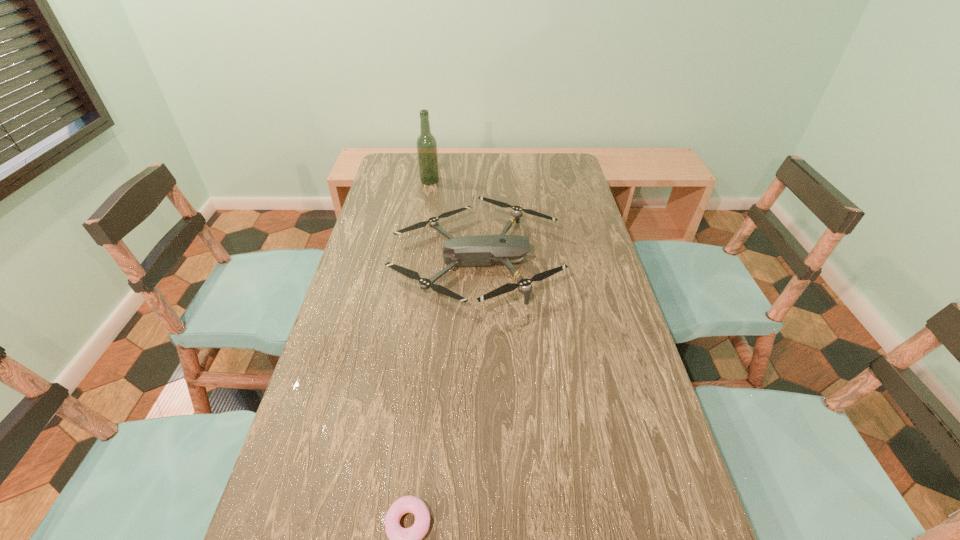
You are a GUI agent. You are given a task and a screenshot of the screen. Output one action in this format:
    pyautogui.click(x=<x>, y=<y>)
    Task: Click on the second closest object relative to the liquor
    Image resolution: width=960 pixels, height=540 pixels.
    Given the screenshot: What is the action you would take?
    pyautogui.click(x=401, y=539)